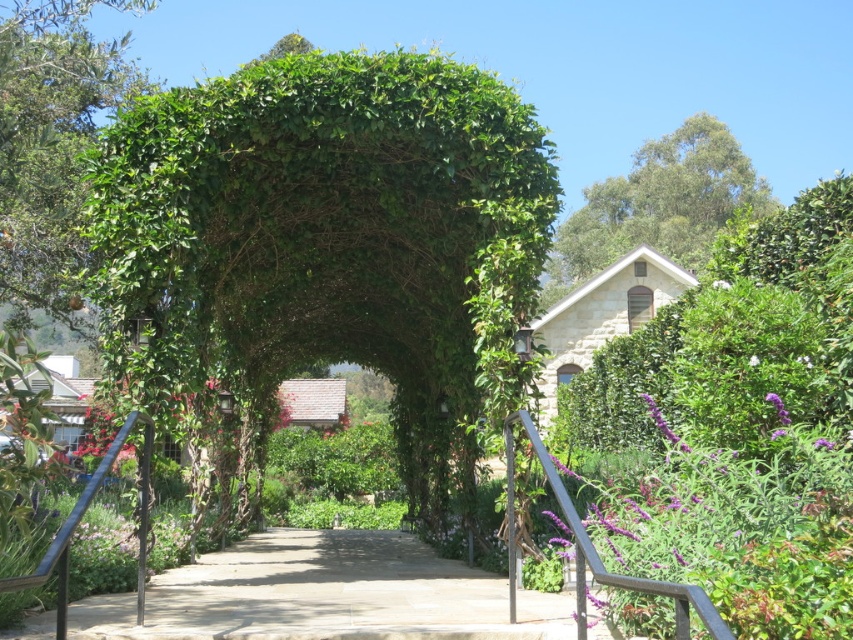
Can you confirm if green leafy tree at upper left is wider than green leafy tree at upper right?

Indeed, green leafy tree at upper left has a greater width compared to green leafy tree at upper right.

Does green leafy tree at upper left appear on the left side of green leafy tree at upper right?

Yes, green leafy tree at upper left is to the left of green leafy tree at upper right.

The height and width of the screenshot is (640, 853). In order to click on green leafy tree at upper left in this screenshot , I will do (50, 145).

Which is below, gray concrete path at center or green leafy tree at upper left?

gray concrete path at center is below.

Does gray concrete path at center appear over green leafy tree at upper left?

Incorrect, gray concrete path at center is not positioned above green leafy tree at upper left.

Is point (492, 589) less distant than point (103, 44)?

Yes, it is.

Locate an element on the screen. gray concrete path at center is located at coordinates (323, 595).

Does point (163, 637) come closer to viewer compared to point (689, 122)?

Yes, point (163, 637) is closer to viewer.

Based on the photo, between gray concrete path at center and green leafy tree at upper right, which one has less height?

Standing shorter between the two is gray concrete path at center.

Is point (132, 602) closer to camera compared to point (651, 179)?

Yes, it is in front of point (651, 179).

This screenshot has height=640, width=853. Identify the location of gray concrete path at center. (323, 595).